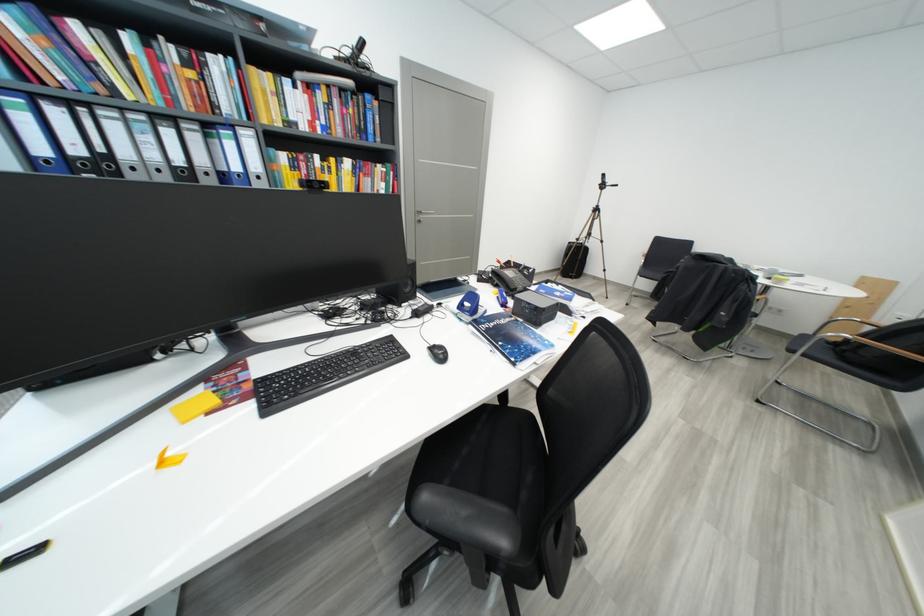
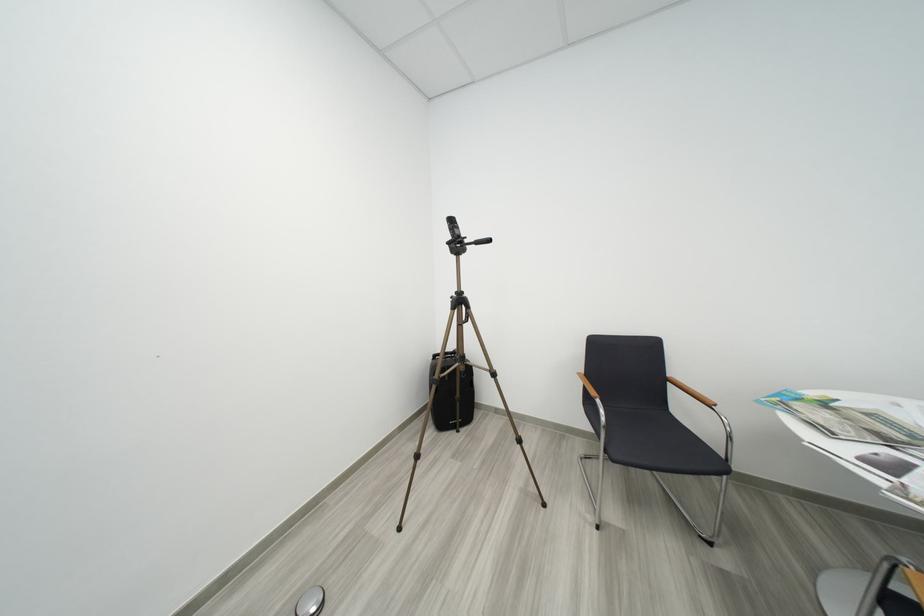
The images are taken continuously from a first-person perspective. In which direction are you moving?

The cameraman walked toward right, forward.